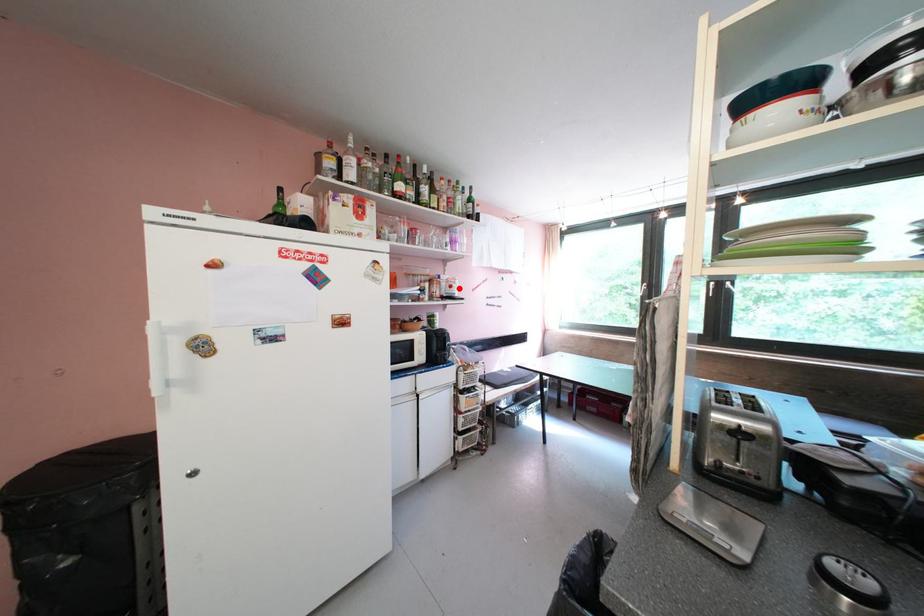
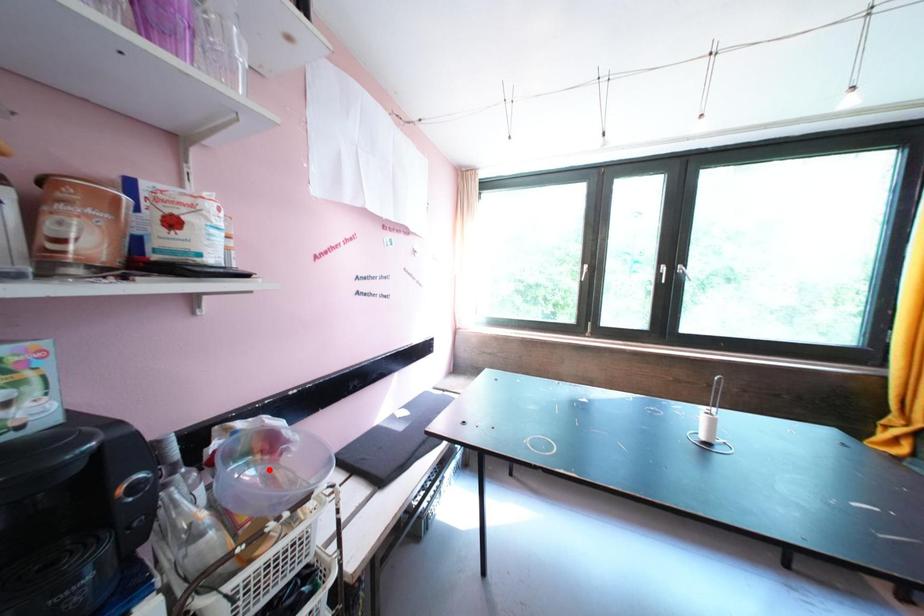
I am providing you with two images of the same scene from different viewpoints. A red point is marked on the first image and another point is marked on the second image. Is the marked point in image1 the same physical position as the marked point in image2?

No